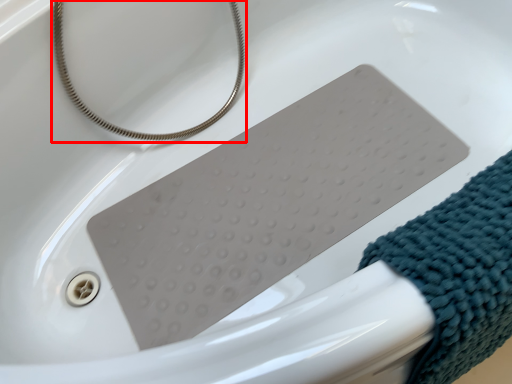
Question: Observing the image, what is the correct spatial positioning of string (annotated by the red box) in reference to wrap?

Choices:
 (A) left
 (B) right

Answer: (A)